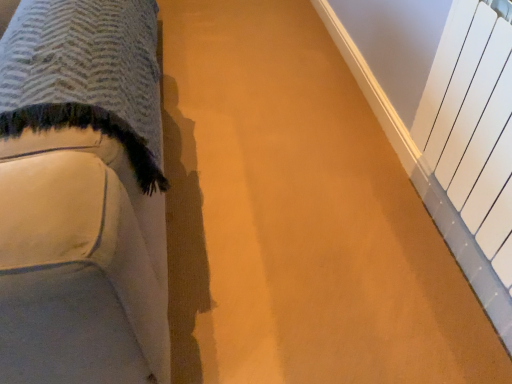
Question: Based on their positions, is white fabric couch at left located to the left or right of white matte radiator at right?

Choices:
 (A) left
 (B) right

Answer: (A)

Question: Looking at the image, does white fabric couch at left seem bigger or smaller compared to white matte radiator at right?

Choices:
 (A) small
 (B) big

Answer: (B)

Question: Is point (62, 205) positioned closer to the camera than point (460, 114)?

Choices:
 (A) farther
 (B) closer

Answer: (B)

Question: Considering the positions of point (485, 137) and point (117, 223), is point (485, 137) closer or farther from the camera than point (117, 223)?

Choices:
 (A) farther
 (B) closer

Answer: (A)

Question: From their relative heights in the image, would you say white matte radiator at right is taller or shorter than white fabric couch at left?

Choices:
 (A) tall
 (B) short

Answer: (B)

Question: From the image's perspective, relative to white fabric couch at left, is white matte radiator at right above or below?

Choices:
 (A) above
 (B) below

Answer: (B)

Question: Would you say white matte radiator at right is inside or outside white fabric couch at left?

Choices:
 (A) inside
 (B) outside

Answer: (B)